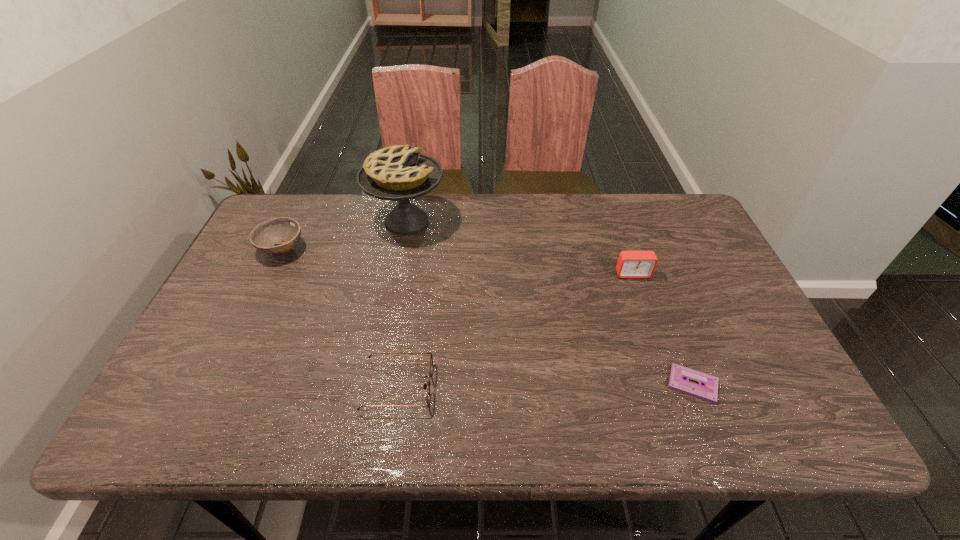
This screenshot has width=960, height=540. Identify the location of free space between the bowl and the sunglasses. (340, 318).

The image size is (960, 540). In order to click on unoccupied position between the alarm clock and the tallest object in this screenshot , I will do `click(519, 247)`.

I want to click on empty space that is in between the third nearest object and the sunglasses, so click(x=516, y=330).

The height and width of the screenshot is (540, 960). Identify the location of free area in between the pie and the leftmost object. (345, 235).

Find the location of a particular element. The height and width of the screenshot is (540, 960). the closest object to the pie is located at coordinates (286, 231).

Locate an element on the screen. The height and width of the screenshot is (540, 960). object that ranks as the third closest to the videotape is located at coordinates (399, 173).

You are a GUI agent. You are given a task and a screenshot of the screen. Output one action in this format:
    pyautogui.click(x=<x>, y=<y>)
    Task: Click on the blank space that satisfies the following two spatial constraints: 1. on the front-facing side of the alarm clock; 2. on the front-facing side of the fourth tallest object
    
    Given the screenshot: What is the action you would take?
    pyautogui.click(x=672, y=386)

Find the location of a particular element. free space in the image that satisfies the following two spatial constraints: 1. on the front-facing side of the alarm clock; 2. on the front-facing side of the second shortest object is located at coordinates (672, 386).

I want to click on free space that satisfies the following two spatial constraints: 1. on the front-facing side of the third farthest object; 2. on the front-facing side of the sunglasses, so click(x=672, y=386).